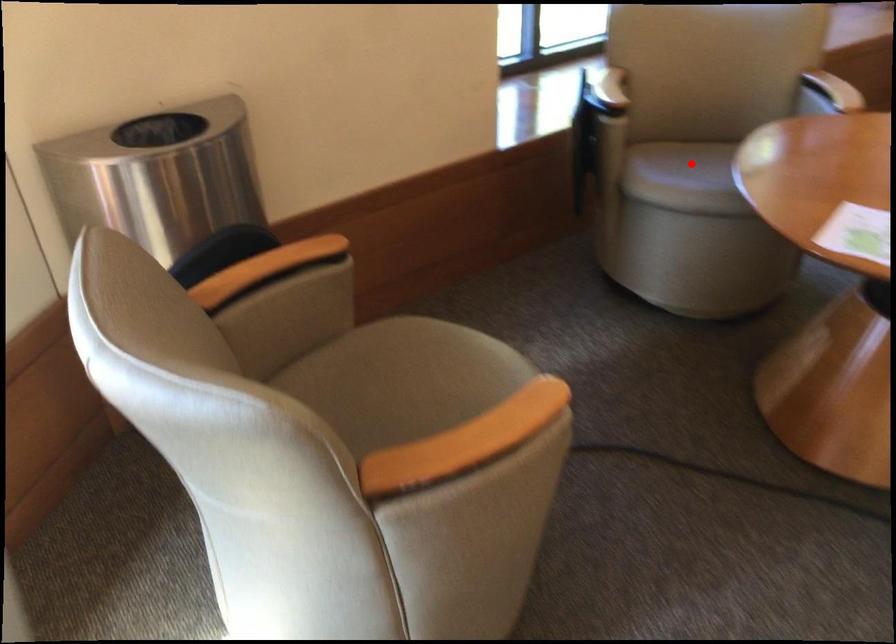
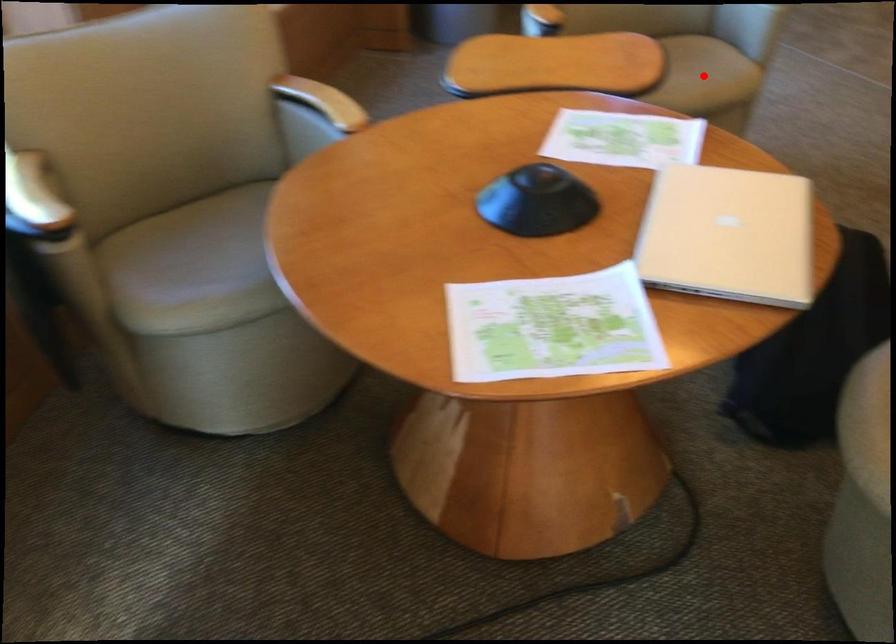
I am providing you with two images of the same scene from different viewpoints. A red point is marked on the first image and another point is marked on the second image. Do the highlighted points in image1 and image2 indicate the same real-world spot?

No